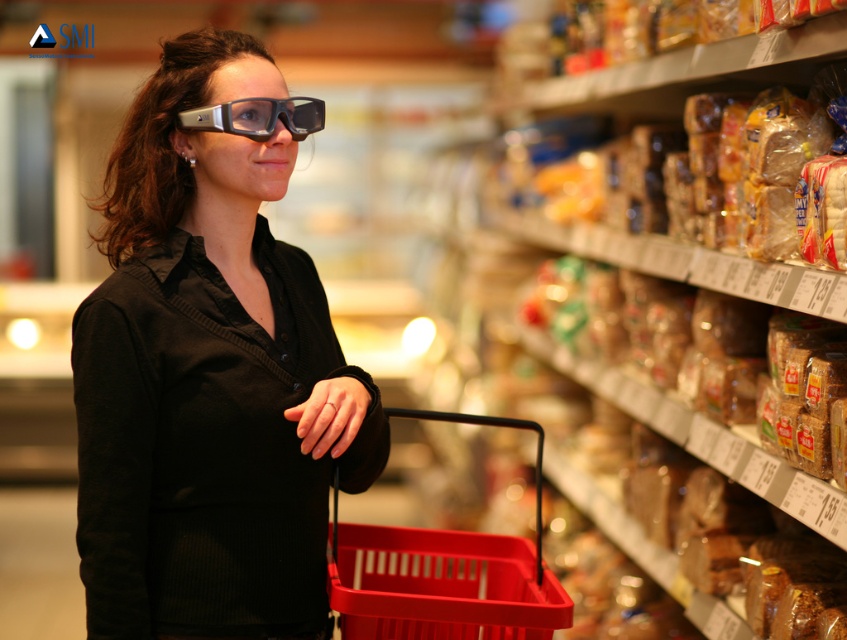
You are a store employee who needs to determine if the matte plastic basket at lower center can fit under the matte black shirt at center without overlapping. Based on their widths, can it fit?

The matte black shirt at center might be wider than matte plastic basket at lower center, so there is a possibility that the matte plastic basket at lower center can fit under it without overlapping, but the exact width is uncertain.

You are a store employee who needs to place a new price tag between the matte black shirt at center and the matte plastic basket at lower center. Which object should you place it closer to if the tag needs to be near the left side of the shelf?

The matte black shirt at center is positioned on the left side of the matte plastic basket at lower center, so the price tag should be placed closer to the matte black shirt at center to be near the left side of the shelf.

You are a grocery store employee and need to place the translucent plastic bread at upper right into the matte plastic basket at lower center. Can the bread fit inside the basket based on their sizes?

The matte plastic basket at lower center has a larger size compared to the translucent plastic bread at upper right, so yes, the bread can fit inside the basket.